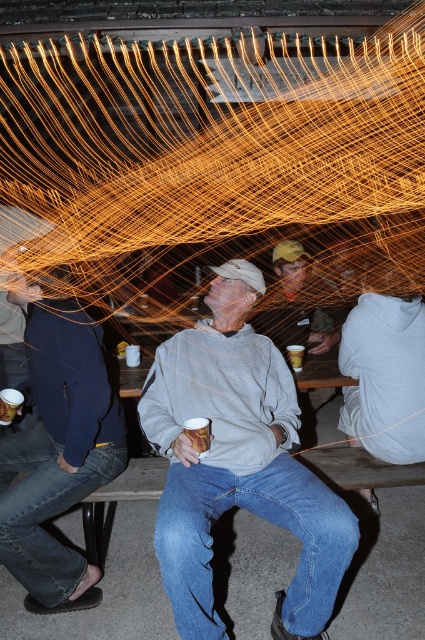
Looking at this image, is dark blue fleece jacket at left wider than gray cotton sweatshirt at center?

Yes, dark blue fleece jacket at left is wider than gray cotton sweatshirt at center.

Describe the element at coordinates (57, 451) in the screenshot. Image resolution: width=425 pixels, height=640 pixels. I see `dark blue fleece jacket at left` at that location.

Consider the image. Who is more distant from viewer, [87,465] or [346,353]?

The point [346,353] is more distant.

This screenshot has height=640, width=425. What are the coordinates of `dark blue fleece jacket at left` in the screenshot? It's located at (57, 451).

Which of these two, gray cotton sweatshirt at center or white glossy mug at center, stands shorter?

With less height is white glossy mug at center.

Does gray cotton sweatshirt at center appear over white glossy mug at center?

Yes, gray cotton sweatshirt at center is above white glossy mug at center.

Does point (340, 342) lie in front of point (190, 420)?

No, (340, 342) is further to viewer.

In order to click on gray cotton sweatshirt at center in this screenshot , I will do `click(385, 368)`.

In the scene shown: Can you confirm if dark blue fleece jacket at left is taller than white glossy mug at center?

Yes, dark blue fleece jacket at left is taller than white glossy mug at center.

Who is taller, dark blue fleece jacket at left or white glossy mug at center?

With more height is dark blue fleece jacket at left.

Locate an element on the screen. Image resolution: width=425 pixels, height=640 pixels. dark blue fleece jacket at left is located at coordinates pos(57,451).